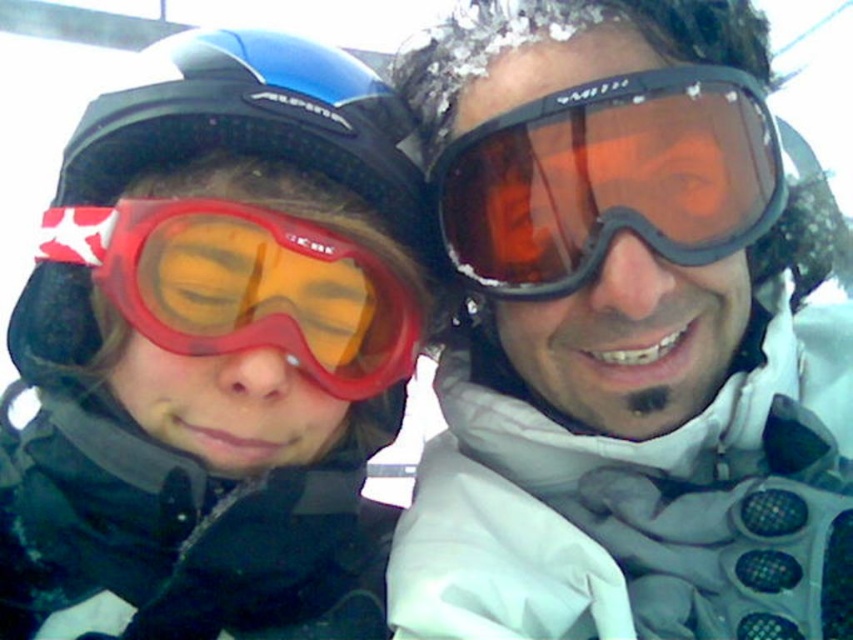
Question: Does matte orange lens goggles at center have a larger size compared to matte red ski goggles at left?

Choices:
 (A) no
 (B) yes

Answer: (A)

Question: Is matte orange lens goggles at center further to camera compared to matte red ski goggles at left?

Choices:
 (A) no
 (B) yes

Answer: (B)

Question: Is matte orange lens goggles at center wider than matte red ski goggles at left?

Choices:
 (A) no
 (B) yes

Answer: (A)